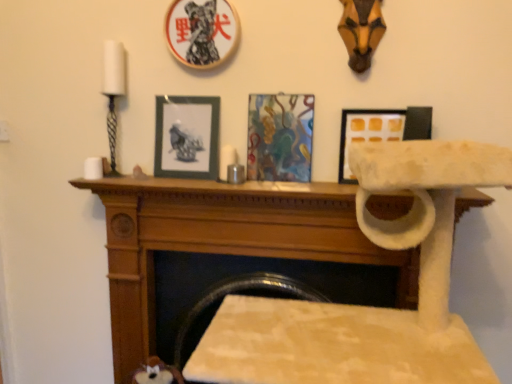
Question: Can we say wooden mantle at center lies outside wooden picture frame at upper center, the 2th picture frame from the left?

Choices:
 (A) no
 (B) yes

Answer: (B)

Question: From the image's perspective, is wooden mantle at center below wooden picture frame at upper center, the 2th picture frame from the left?

Choices:
 (A) no
 (B) yes

Answer: (B)

Question: Is wooden mantle at center positioned with its back to wooden picture frame at upper center, the third picture frame viewed from the right?

Choices:
 (A) yes
 (B) no

Answer: (B)

Question: From a real-world perspective, is wooden mantle at center positioned under wooden picture frame at upper center, the third picture frame viewed from the right, based on gravity?

Choices:
 (A) yes
 (B) no

Answer: (A)

Question: Does wooden mantle at center have a lesser width compared to wooden picture frame at upper center, the third picture frame viewed from the right?

Choices:
 (A) no
 (B) yes

Answer: (A)

Question: Is blue-gray matte picture frame at center, which is counted as the first picture frame, starting from the left, in front of or behind white felt cat tree at center in the image?

Choices:
 (A) behind
 (B) front

Answer: (A)

Question: In terms of size, does blue-gray matte picture frame at center, which is counted as the first picture frame, starting from the left, appear bigger or smaller than white felt cat tree at center?

Choices:
 (A) small
 (B) big

Answer: (A)

Question: Is point (217, 172) closer or farther from the camera than point (409, 198)?

Choices:
 (A) farther
 (B) closer

Answer: (A)

Question: From the image's perspective, is blue-gray matte picture frame at center, which is counted as the first picture frame, starting from the left, located above or below white felt cat tree at center?

Choices:
 (A) above
 (B) below

Answer: (A)

Question: Is wooden mantle at center inside or outside of white felt cat tree at center?

Choices:
 (A) outside
 (B) inside

Answer: (A)

Question: From the image's perspective, relative to white felt cat tree at center, is wooden mantle at center above or below?

Choices:
 (A) above
 (B) below

Answer: (A)

Question: Based on their sizes in the image, would you say wooden mantle at center is bigger or smaller than white felt cat tree at center?

Choices:
 (A) small
 (B) big

Answer: (A)

Question: In the image, is wooden mantle at center on the left side or the right side of white felt cat tree at center?

Choices:
 (A) left
 (B) right

Answer: (A)

Question: From a real-world perspective, is abstract painting at center, the second picture frame when ordered from right to left, above or below white matte picture frame at upper center, the 4th picture frame positioned from the left?

Choices:
 (A) above
 (B) below

Answer: (A)

Question: Based on their positions, is abstract painting at center, the second picture frame when ordered from right to left, located to the left or right of white matte picture frame at upper center, arranged as the first picture frame when viewed from the right?

Choices:
 (A) left
 (B) right

Answer: (A)